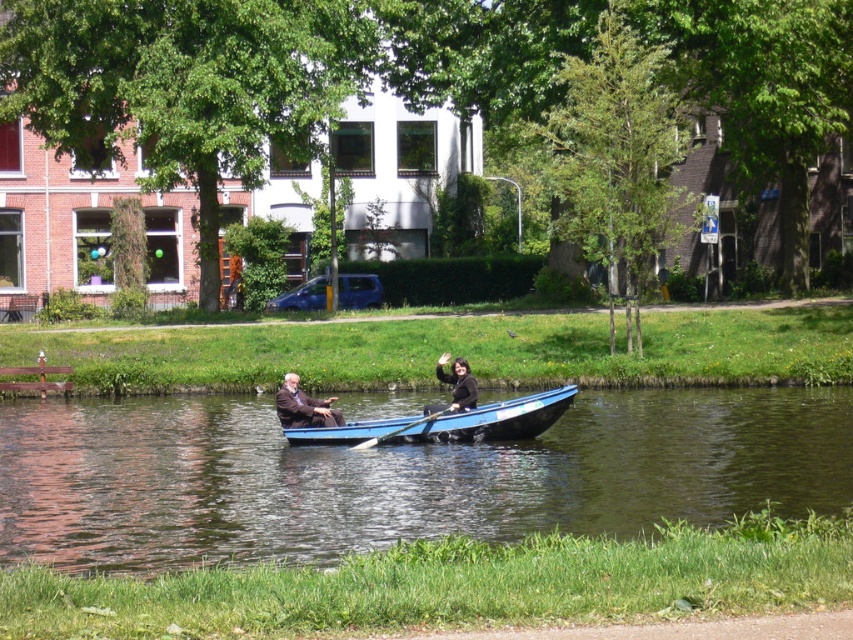
You are planning to row the blue polished wood canoe at center across the blue smooth water at center. Based on their sizes, can the canoe fit comfortably on the water without touching the edges?

The blue smooth water at center is wider than the blue polished wood canoe at center, so the canoe can fit comfortably on the water without touching the edges.

You are planning to place a dark brown leather jacket at center on the blue polished wood canoe at center. Can you confirm if the jacket will fit on the canoe?

The blue polished wood canoe at center might be wider than dark brown leather jacket at center, so there is a possibility that the jacket will fit on the canoe.

You are a kayaker planning to paddle between the blue smooth water at center and the blue polished wood canoe at center. Given that your kayak is 15 feet long, will there be enough space to pass through without touching either?

The blue smooth water at center and blue polished wood canoe at center are 14.71 feet apart from each other. Since your kayak is 15 feet long, there isn not enough space to pass through without touching either.